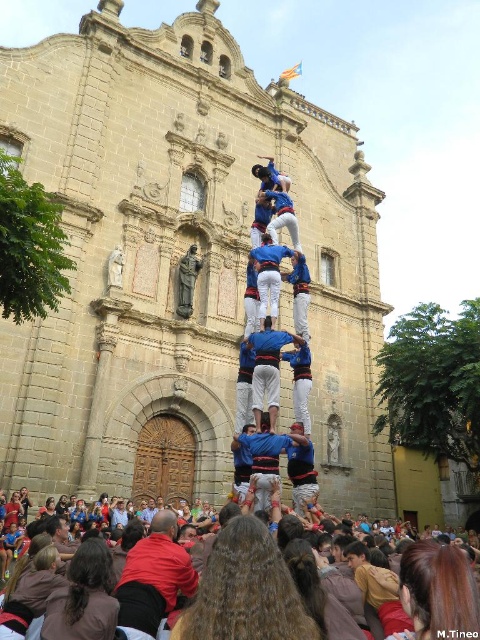
You are standing in front of the historic stone church and see two people dressed in blue fabric clothing. One is wearing a blue fabric shirt at center and the other is a blue fabric man at center. Which one is closer to you?

The blue fabric shirt at center is closer to you because it is further to the viewer than the blue fabric man at center.